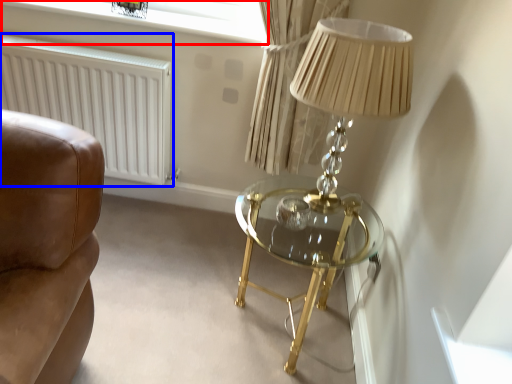
Question: Which of the following is the closest to the observer, window screen (highlighted by a red box) or radiator (highlighted by a blue box)?

Choices:
 (A) window screen
 (B) radiator

Answer: (B)